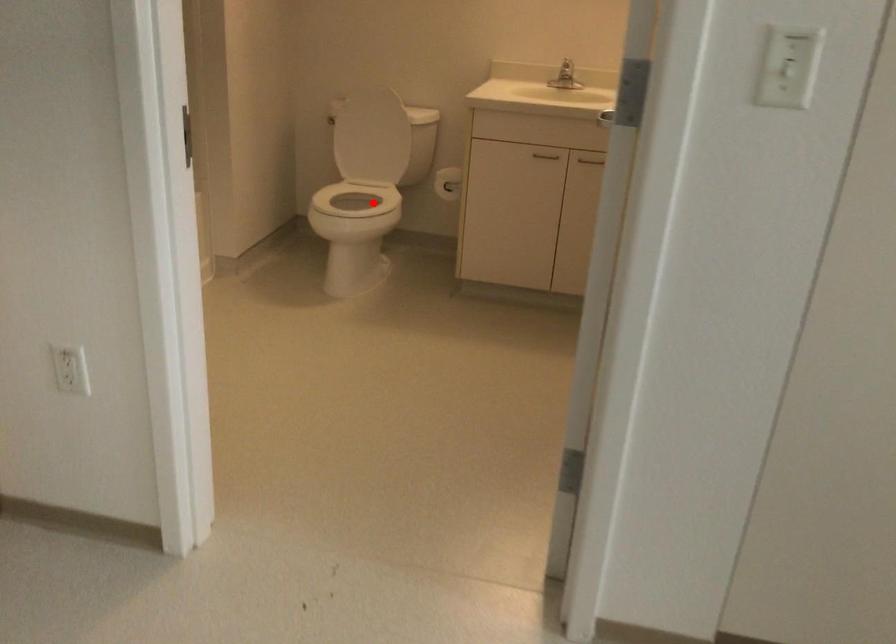
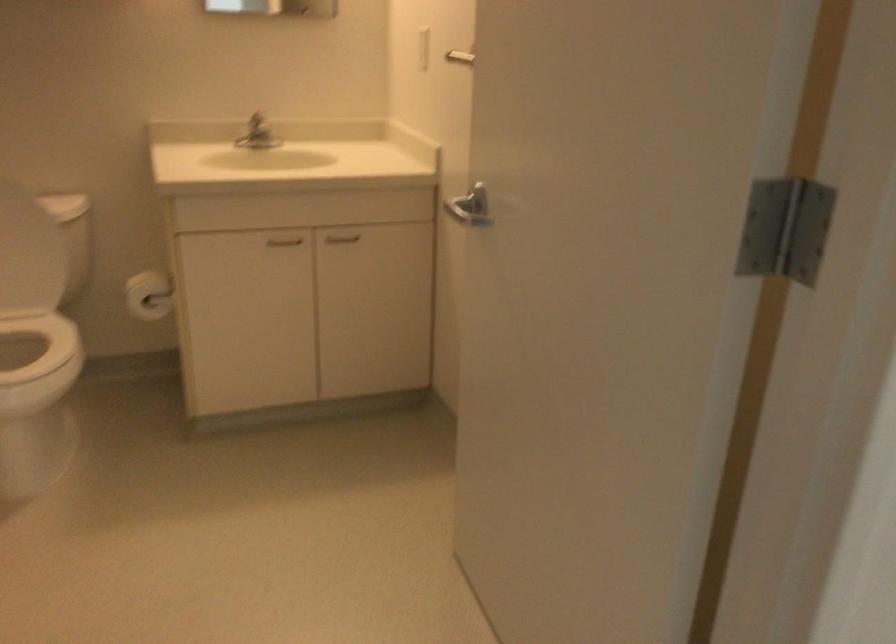
Question: I am providing you with two images of the same scene from different viewpoints. Image1 has a red point marked. In image2, the corresponding 3D location appears at what relative position? Reply with the corresponding letter.

Choices:
 (A) Closer
 (B) Farther

Answer: (A)